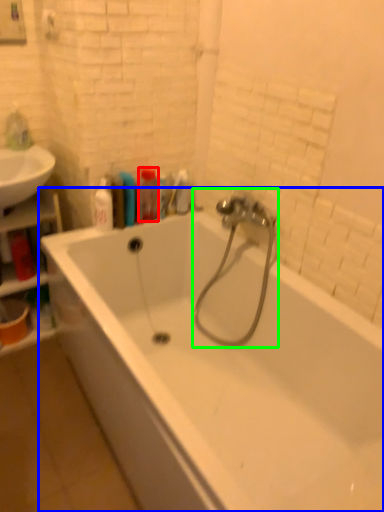
Question: Based on their relative distances, which object is nearer to toiletry (highlighted by a red box)? Choose from bathtub (highlighted by a blue box) and garden hose (highlighted by a green box).

Choices:
 (A) bathtub
 (B) garden hose

Answer: (B)